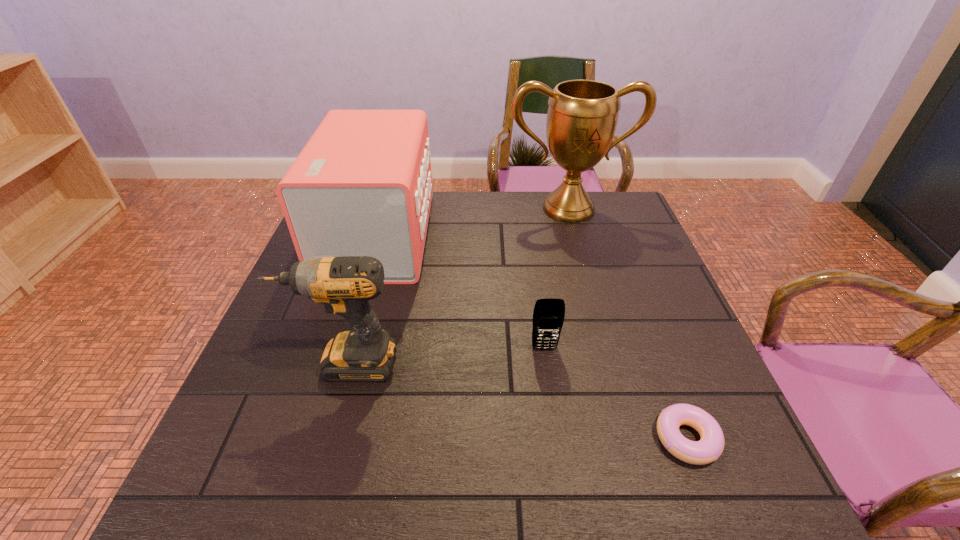
The image size is (960, 540). I want to click on trophy cup, so click(582, 116).

Image resolution: width=960 pixels, height=540 pixels. I want to click on box, so click(x=362, y=186).

Find the location of a particular element. drill is located at coordinates (344, 285).

Locate an element on the screen. The image size is (960, 540). the fourth tallest object is located at coordinates (548, 316).

At what (x,y) coordinates should I click in order to perform the action: click on doughnut. Please return your answer as a coordinate pair (x, y). Looking at the image, I should click on (709, 448).

Locate an element on the screen. the shortest object is located at coordinates coord(709,448).

Where is `free space located on the surface of the tallest object with symbols`? The width and height of the screenshot is (960, 540). free space located on the surface of the tallest object with symbols is located at coordinates (577, 238).

Locate an element on the screen. The width and height of the screenshot is (960, 540). vacant position located on the surface of the box where the text is embossed is located at coordinates coord(520,235).

The image size is (960, 540). I want to click on free location located 0.080m with the drill bit of the drill facing forward, so click(x=255, y=363).

At what (x,y) coordinates should I click in order to perform the action: click on free space located with the drill bit of the drill facing forward. Please return your answer as a coordinate pair (x, y). The image size is (960, 540). Looking at the image, I should click on (269, 363).